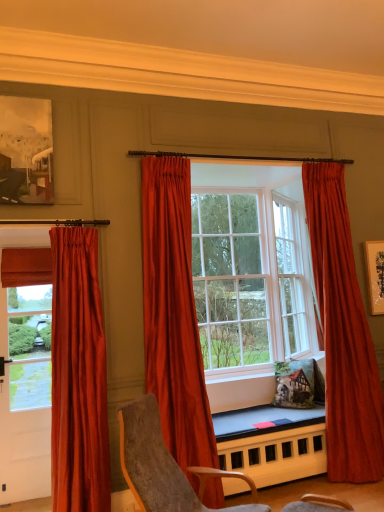
Question: From the image's perspective, is satin orange curtain at center, placed as the 2th curtain when sorted from left to right, above or below matte wooden picture frame at upper left?

Choices:
 (A) above
 (B) below

Answer: (B)

Question: Looking at their shapes, would you say satin orange curtain at center, placed as the 2th curtain when sorted from left to right, is wider or thinner than matte wooden picture frame at upper left?

Choices:
 (A) wide
 (B) thin

Answer: (A)

Question: Which is farther from the satin red curtain at left, marked as the first curtain in a left-to-right arrangement?

Choices:
 (A) velvet gray chair at center
 (B) satin red curtain at center, positioned as the third curtain in left-to-right order
 (C) smooth wooden table at center
 (D) satin red curtains at center
 (E) matte wooden picture frame at upper left

Answer: (B)

Question: Which object is the closest to the velvet gray chair at center?

Choices:
 (A) satin red curtains at center
 (B) matte wooden picture frame at upper left
 (C) smooth wooden table at center
 (D) satin red curtain at left, which is the third curtain in right-to-left order
 (E) satin red curtain at center, positioned as the third curtain in left-to-right order

Answer: (D)